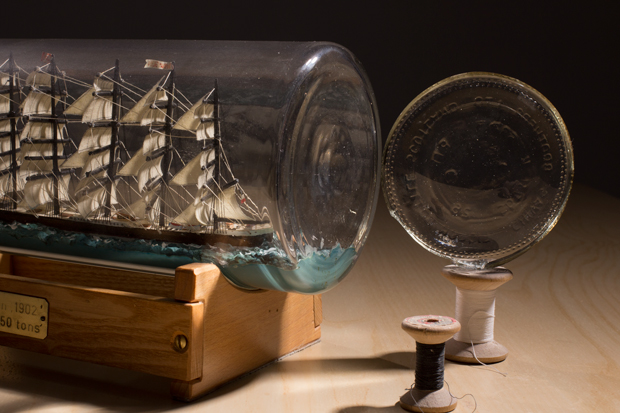
Where is `golden colored plaque label`? This screenshot has height=413, width=620. golden colored plaque label is located at coordinates pyautogui.click(x=20, y=315).